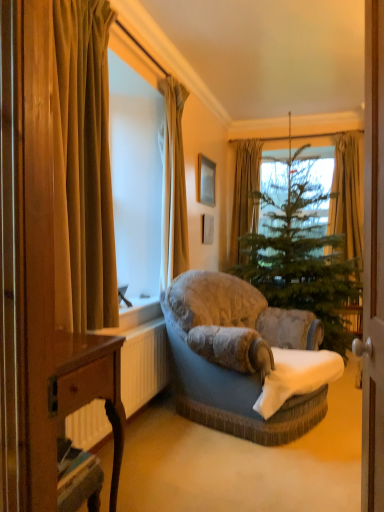
Identify the location of empty space that is in between velvet grey couch at center and white plastic radiator at lower left. (180, 452).